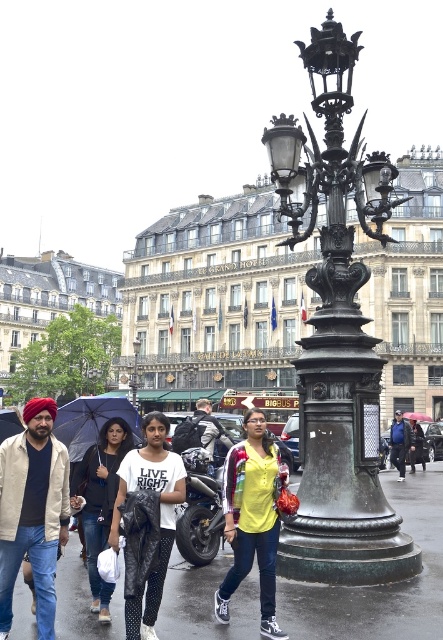
Who is positioned more to the right, matte black jacket at lower left or shiny black motorcycle at center?

shiny black motorcycle at center

Between matte black jacket at lower left and shiny black motorcycle at center, which one is positioned higher?

shiny black motorcycle at center is above.

Is point (105, 545) more distant than point (206, 499)?

That is False.

Identify the location of matte black jacket at lower left. (100, 502).

Consider the image. Can you confirm if yellow fabric shirt at center is positioned to the right of bronze ornate streetlight at center?

Yes, yellow fabric shirt at center is to the right of bronze ornate streetlight at center.

Who is lower down, yellow fabric shirt at center or bronze ornate streetlight at center?

yellow fabric shirt at center is below.

Is point (260, 534) positioned in front of point (136, 353)?

Yes, it is in front of point (136, 353).

The height and width of the screenshot is (640, 443). I want to click on yellow fabric shirt at center, so click(252, 518).

Does point (127, 408) come closer to viewer compared to point (403, 438)?

Yes, it is.

Which is above, transparent plastic umbrella at center or blue denim jacket at center?

transparent plastic umbrella at center is higher up.

Does point (73, 460) come closer to viewer compared to point (395, 444)?

Yes, it is.

Find the location of a particular element. Image resolution: width=443 pixels, height=640 pixels. transparent plastic umbrella at center is located at coordinates (92, 420).